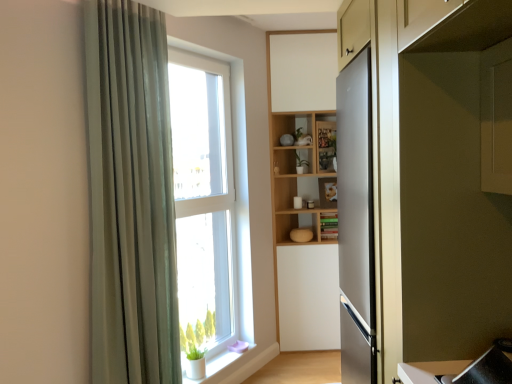
Where is `green matte cabinet at center`? The image size is (512, 384). green matte cabinet at center is located at coordinates (329, 225).

Describe the element at coordinates (301, 161) in the screenshot. I see `green matte plant at center` at that location.

Image resolution: width=512 pixels, height=384 pixels. What do you see at coordinates (130, 195) in the screenshot? I see `green fabric curtain at left` at bounding box center [130, 195].

Locate an element on the screen. The height and width of the screenshot is (384, 512). green matte cabinet at center is located at coordinates (329, 225).

From the image's perspective, does green matte plant at center appear higher than clear glass window at center?

Yes.

Is green matte plant at center aimed at clear glass window at center?

No, green matte plant at center does not turn towards clear glass window at center.

Between green matte plant at center and clear glass window at center, which one has larger width?

green matte plant at center.

Which is more to the right, green matte plant at center or clear glass window at center?

green matte plant at center.

Based on the photo, from the image's perspective, would you say white matte window sill at lower left is positioned over satin silver refrigerator at right?

Actually, white matte window sill at lower left appears below satin silver refrigerator at right in the image.

Between white matte window sill at lower left and satin silver refrigerator at right, which one has smaller size?

white matte window sill at lower left.

From a real-world perspective, does white matte window sill at lower left stand above satin silver refrigerator at right?

Incorrect, from a real-world perspective, white matte window sill at lower left is lower than satin silver refrigerator at right.

Does green matte plant at center come in front of green matte cabinet at center?

That is True.

Considering the relative positions of green matte plant at center and green matte cabinet at center in the image provided, is green matte plant at center to the left of green matte cabinet at center from the viewer's perspective?

Correct, you'll find green matte plant at center to the left of green matte cabinet at center.

From the image's perspective, is green matte plant at center beneath green matte cabinet at center?

Actually, green matte plant at center appears above green matte cabinet at center in the image.

How much distance is there between green matte plant at center and green matte cabinet at center?

green matte plant at center is 52.50 centimeters from green matte cabinet at center.

Is satin silver refrigerator at right located outside green matte plant at center?

Absolutely, satin silver refrigerator at right is external to green matte plant at center.

Considering the relative sizes of satin silver refrigerator at right and green matte plant at center in the image provided, is satin silver refrigerator at right taller than green matte plant at center?

Indeed, satin silver refrigerator at right has a greater height compared to green matte plant at center.

Does satin silver refrigerator at right turn towards green matte plant at center?

No, satin silver refrigerator at right is not facing towards green matte plant at center.

From a real-world perspective, is satin silver refrigerator at right physically located above or below green matte plant at center?

In terms of real-world spatial position, satin silver refrigerator at right is below green matte plant at center.

Is the depth of satin silver refrigerator at right less than that of green fabric curtain at left?

Yes, satin silver refrigerator at right is in front of green fabric curtain at left.

From the image's perspective, is satin silver refrigerator at right located above or below green fabric curtain at left?

Based on their image positions, satin silver refrigerator at right is located beneath green fabric curtain at left.

Which is farther, (481, 82) or (99, 252)?

The point (99, 252) is farther.

Considering the relative positions of satin silver refrigerator at right and green fabric curtain at left in the image provided, is satin silver refrigerator at right to the left or to the right of green fabric curtain at left?

Based on their positions, satin silver refrigerator at right is located to the right of green fabric curtain at left.

Is green fabric curtain at left inside the boundaries of green matte cabinet at center, or outside?

green fabric curtain at left exists outside the volume of green matte cabinet at center.

Which point is more forward, (x=142, y=348) or (x=330, y=229)?

The point (x=142, y=348) is closer.

At what (x,y) coordinates should I click in order to perform the action: click on curtain in front of the green matte cabinet at center. Please return your answer as a coordinate pair (x, y). Looking at the image, I should click on (130, 195).

Is green fabric curtain at left bigger or smaller than green matte cabinet at center?

A: In the image, green fabric curtain at left appears to be larger than green matte cabinet at center.

Which object is further away from the camera, clear glass window at center or white matte window sill at lower left?

white matte window sill at lower left is more distant.

Considering the points (222, 249) and (201, 380), which point is in front, point (222, 249) or point (201, 380)?

The point (201, 380) is closer to the camera.

Would you say clear glass window at center is a long distance from white matte window sill at lower left?

clear glass window at center is actually quite close to white matte window sill at lower left.

Measure the distance between clear glass window at center and white matte window sill at lower left.

A distance of 19.18 inches exists between clear glass window at center and white matte window sill at lower left.

You are a GUI agent. You are given a task and a screenshot of the screen. Output one action in this format:
    pyautogui.click(x=<x>, y=<y>)
    Task: Click on the plant located on the right of clear glass window at center
    
    Given the screenshot: What is the action you would take?
    pyautogui.click(x=301, y=161)

At what (x,y) coordinates should I click in order to perform the action: click on cabinetry located above the white matte window sill at lower left (from a real-world perspective). Please return your answer as a coordinate pair (x, y). Looking at the image, I should click on (439, 173).

Estimate the real-world distances between objects in this image. Which object is closer to clear glass window at center, green matte plant at center or green matte cabinet at center?

The object closer to clear glass window at center is green matte cabinet at center.

Estimate the real-world distances between objects in this image. Which object is closer to green matte plant at center, satin silver refrigerator at right or green fabric curtain at left?

Among the two, green fabric curtain at left is located nearer to green matte plant at center.

Looking at the image, which one is located further to satin silver refrigerator at right, white matte window sill at lower left or clear glass window at center?

Among the two, white matte window sill at lower left is located further to satin silver refrigerator at right.

Considering their positions, is green fabric curtain at left positioned further to satin silver refrigerator at right than green matte cabinet at center?

The object further to satin silver refrigerator at right is green matte cabinet at center.

Estimate the real-world distances between objects in this image. Which object is further from green matte cabinet at center, clear glass window at center or white matte window sill at lower left?

white matte window sill at lower left.

Considering their positions, is green fabric curtain at left positioned closer to green matte cabinet at center than white matte window sill at lower left?

The object closer to green matte cabinet at center is white matte window sill at lower left.

Looking at the image, which one is located further to green matte cabinet at center, green fabric curtain at left or satin silver refrigerator at right?

Among the two, satin silver refrigerator at right is located further to green matte cabinet at center.

In the scene shown: Estimate the real-world distances between objects in this image. Which object is closer to green matte plant at center, satin silver refrigerator at right or white matte window sill at lower left?

white matte window sill at lower left lies closer to green matte plant at center than the other object.

Identify the location of cabinet that lies between clear glass window at center and white matte window sill at lower left from top to bottom. (329, 225).

At what (x,y) coordinates should I click in order to perform the action: click on window between satin silver refrigerator at right and green matte plant at center along the z-axis. Please return your answer as a coordinate pair (x, y). The height and width of the screenshot is (384, 512). Looking at the image, I should click on (211, 207).

Locate an element on the screen. Image resolution: width=512 pixels, height=384 pixels. curtain between satin silver refrigerator at right and green matte plant at center along the z-axis is located at coordinates (130, 195).

You are a GUI agent. You are given a task and a screenshot of the screen. Output one action in this format:
    pyautogui.click(x=<x>, y=<y>)
    Task: Click on the cabinet between green matte plant at center and white matte window sill at lower left in the vertical direction
    Image resolution: width=512 pixels, height=384 pixels.
    Given the screenshot: What is the action you would take?
    pyautogui.click(x=329, y=225)